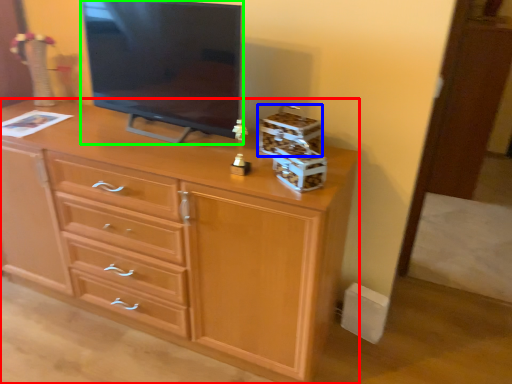
Question: Estimate the real-world distances between objects in this image. Which object is closer to chest of drawers (highlighted by a red box), storage box (highlighted by a blue box) or television (highlighted by a green box)?

Choices:
 (A) storage box
 (B) television

Answer: (B)